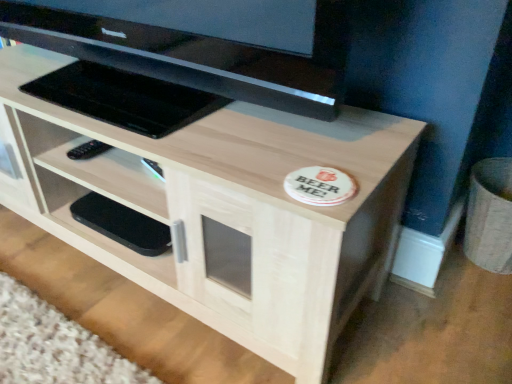
The width and height of the screenshot is (512, 384). I want to click on free space above light wood/texture tv stand at center (from a real-world perspective), so click(x=155, y=108).